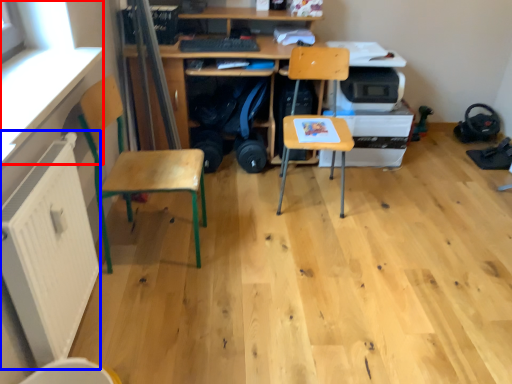
Question: Which of the following is the farthest to the observer, window screen (highlighted by a red box) or radiator (highlighted by a blue box)?

Choices:
 (A) window screen
 (B) radiator

Answer: (B)